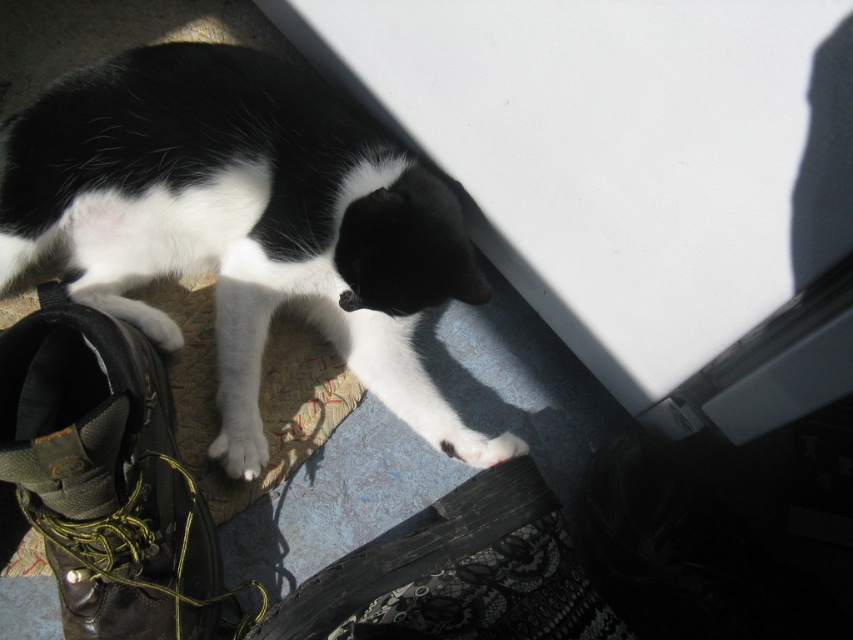
Is leather boot at lower left below white soft fur paw at lower left?

Yes, leather boot at lower left is below white soft fur paw at lower left.

Does leather boot at lower left have a smaller size compared to white soft fur paw at lower left?

Incorrect, leather boot at lower left is not smaller in size than white soft fur paw at lower left.

Which is in front, point (20, 433) or point (244, 433)?

Positioned in front is point (20, 433).

Locate an element on the screen. Image resolution: width=853 pixels, height=640 pixels. leather boot at lower left is located at coordinates (105, 476).

Is the position of black and white fur cat at lower left more distant than that of white soft fur paw at lower left?

That is False.

Which is behind, point (117, 244) or point (231, 464)?

The point (117, 244) is behind.

Locate an element on the screen. The width and height of the screenshot is (853, 640). black and white fur cat at lower left is located at coordinates (242, 218).

Which of these two, black and white fur cat at lower left or leather boot at lower left, stands taller?

black and white fur cat at lower left

Does point (434, 180) come in front of point (166, 412)?

No.

Does point (230, 289) come in front of point (219, 600)?

No, (230, 289) is further to viewer.

Where is `black and white fur cat at lower left`? black and white fur cat at lower left is located at coordinates (242, 218).